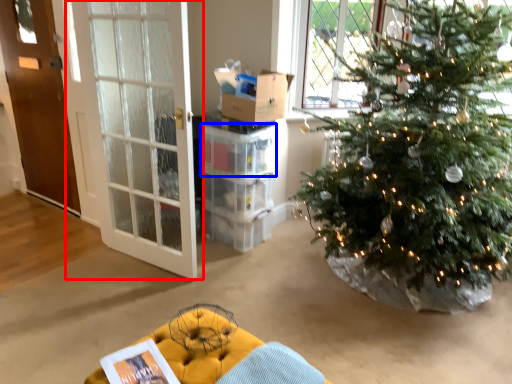
Question: Which object is further to the camera taking this photo, door (highlighted by a red box) or crate (highlighted by a blue box)?

Choices:
 (A) door
 (B) crate

Answer: (B)